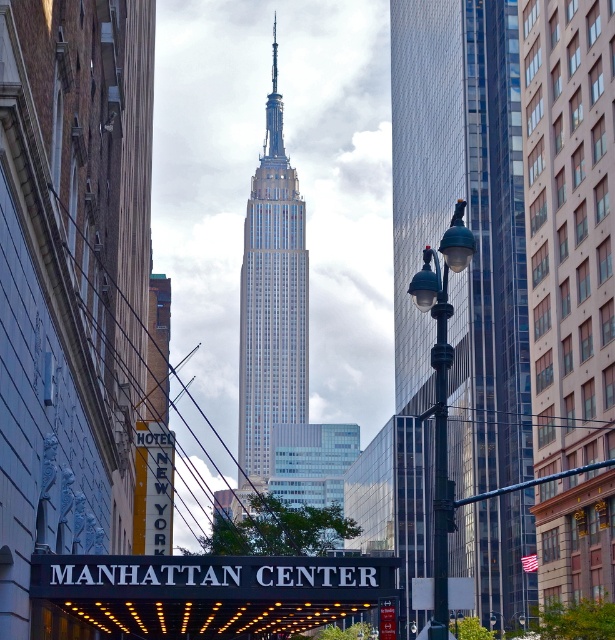
Is glassy steel skyscraper at center to the left of white glass skyscraper at center from the viewer's perspective?

In fact, glassy steel skyscraper at center is to the right of white glass skyscraper at center.

Can you confirm if glassy steel skyscraper at center is positioned above white glass skyscraper at center?

No.

What do you see at coordinates (466, 225) in the screenshot? The image size is (615, 640). I see `glassy steel skyscraper at center` at bounding box center [466, 225].

The image size is (615, 640). I want to click on glassy steel skyscraper at center, so click(466, 225).

Can you confirm if white glass skyscraper at center is positioned above green glass streetlight at center?

Yes, white glass skyscraper at center is above green glass streetlight at center.

Can you confirm if white glass skyscraper at center is positioned to the right of green glass streetlight at center?

No, white glass skyscraper at center is not to the right of green glass streetlight at center.

Who is more forward, (x=295, y=288) or (x=438, y=516)?

Point (x=438, y=516) is in front.

I want to click on white glass skyscraper at center, so click(x=271, y=300).

Does glassy steel skyscraper at center appear over green glass streetlight at center?

Correct, glassy steel skyscraper at center is located above green glass streetlight at center.

Can you confirm if glassy steel skyscraper at center is wider than green glass streetlight at center?

No.

The height and width of the screenshot is (640, 615). In order to click on glassy steel skyscraper at center in this screenshot , I will do `click(466, 225)`.

The image size is (615, 640). In order to click on glassy steel skyscraper at center in this screenshot , I will do `click(466, 225)`.